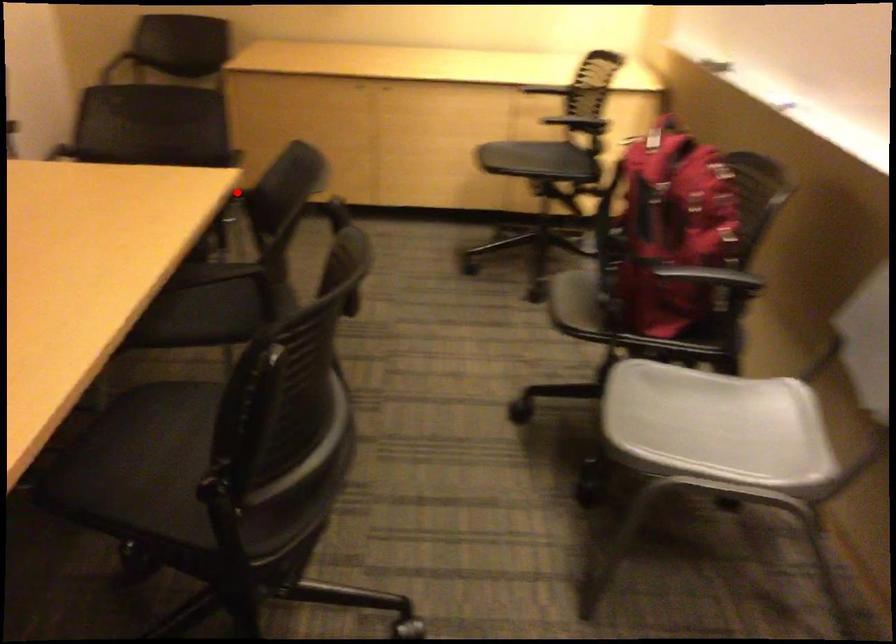
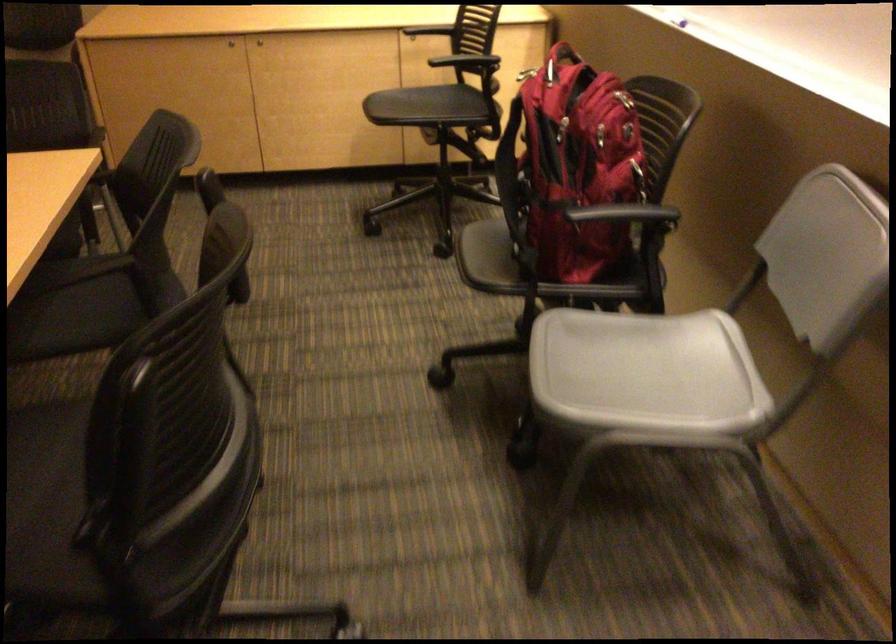
Locate, in the second image, the point that corresponds to the highlighted location in the first image.

(92, 178)